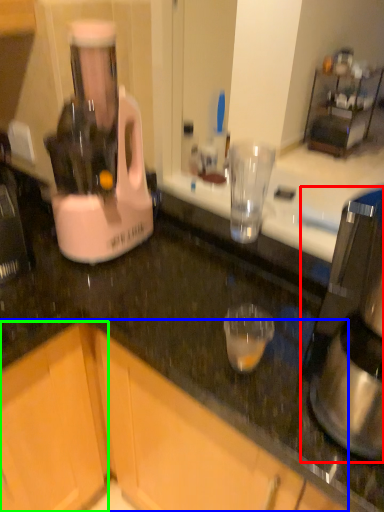
Question: Which object is positioned farthest from coffee maker (highlighted by a red box)? Select from cabinetry (highlighted by a blue box) and cabinetry (highlighted by a green box).

Choices:
 (A) cabinetry
 (B) cabinetry

Answer: (B)